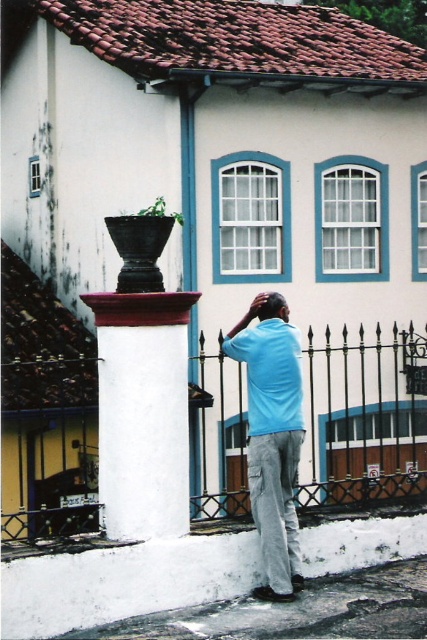
Question: Does iron/glossy fence at center appear under light blue cotton shirt at center?

Choices:
 (A) no
 (B) yes

Answer: (B)

Question: Which of the following is the closest to the observer?

Choices:
 (A) (181, 394)
 (B) (415, 449)
 (C) (286, 589)

Answer: (A)

Question: Among these points, which one is farthest from the camera?

Choices:
 (A) (257, 488)
 (B) (145, 460)

Answer: (A)

Question: Which point appears farthest from the camera in this image?

Choices:
 (A) (265, 419)
 (B) (392, 496)

Answer: (B)

Question: Is iron/glossy fence at center behind white painted stone column at center?

Choices:
 (A) yes
 (B) no

Answer: (A)

Question: Does white painted stone column at center appear on the left side of light blue cotton shirt at center?

Choices:
 (A) no
 (B) yes

Answer: (B)